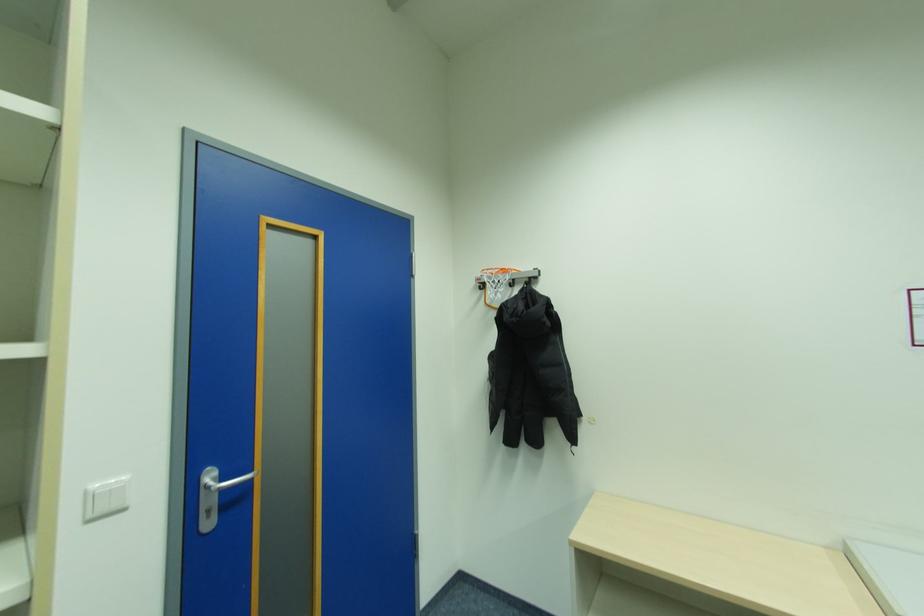
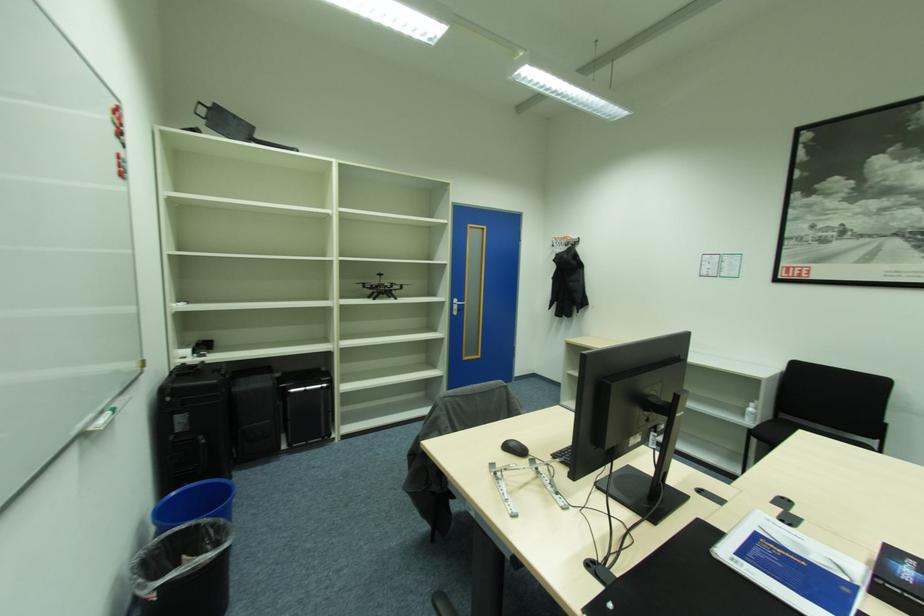
Question: What movement of the cameraman would produce the second image?

Choices:
 (A) Left
 (B) Right
 (C) Forward
 (D) Backward

Answer: (D)